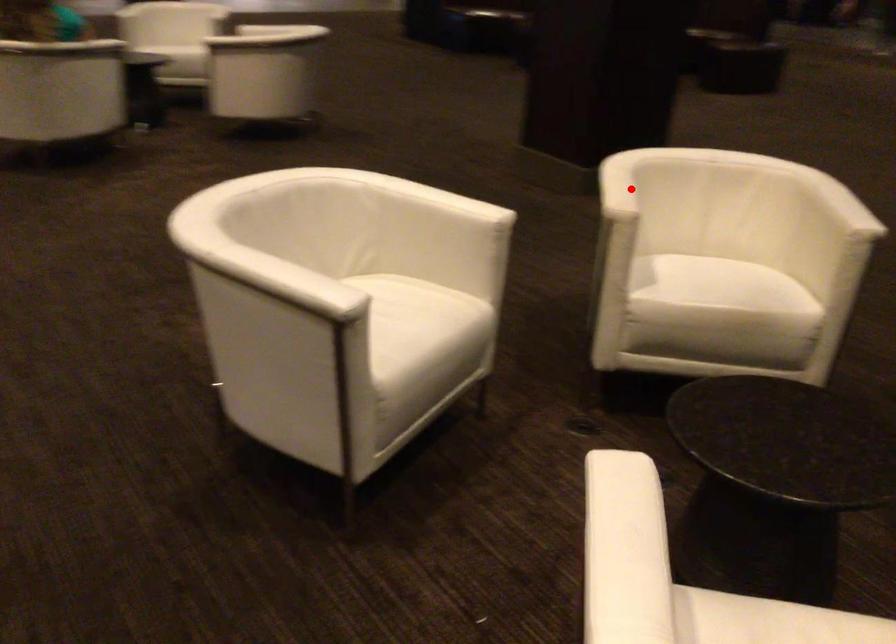
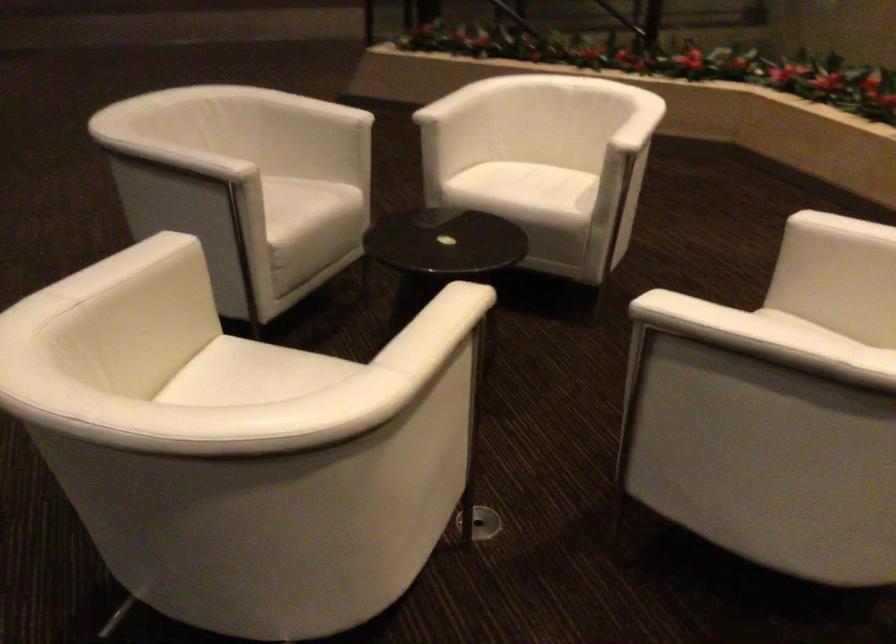
Question: I am providing you with two images of the same scene from different viewpoints. Given a red point in image1, look at the same physical point in image2. Is it:

Choices:
 (A) Closer to the viewpoint
 (B) Farther from the viewpoint

Answer: (A)